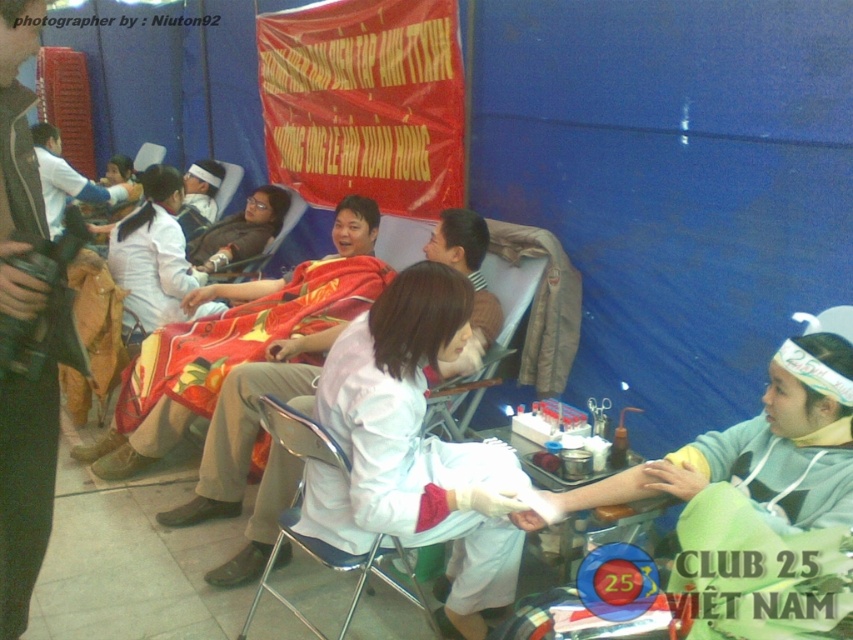
Question: Which point appears farthest from the camera in this image?

Choices:
 (A) (287, 429)
 (B) (22, 211)
 (C) (193, 284)

Answer: (C)

Question: Is metallic silver chair at center smaller than matte black jacket at center?

Choices:
 (A) yes
 (B) no

Answer: (B)

Question: Which point is farther from the camera taking this photo?

Choices:
 (A) pyautogui.click(x=3, y=632)
 (B) pyautogui.click(x=137, y=304)

Answer: (B)

Question: In this image, where is white matte coat at center located relative to white matte coat at upper left?

Choices:
 (A) below
 (B) above

Answer: (A)

Question: Estimate the real-world distances between objects in this image. Which object is farther from the matte black jacket at center?

Choices:
 (A) white matte nurse at center
 (B) white matte coat at center
 (C) white matte coat at upper left
 (D) metallic silver chair at center

Answer: (B)

Question: Is matte red blanket at center thinner than matte black jacket at center?

Choices:
 (A) yes
 (B) no

Answer: (B)